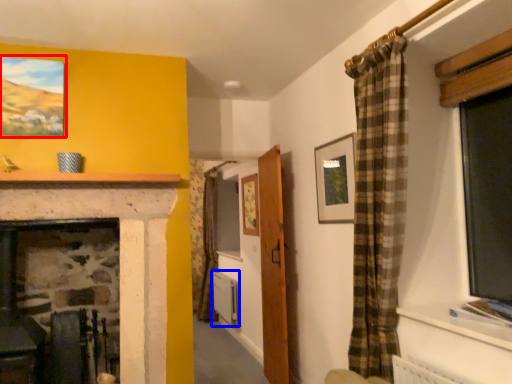
Question: Which object appears closest to the camera in this image, picture frame (highlighted by a red box) or radiator (highlighted by a blue box)?

Choices:
 (A) picture frame
 (B) radiator

Answer: (A)